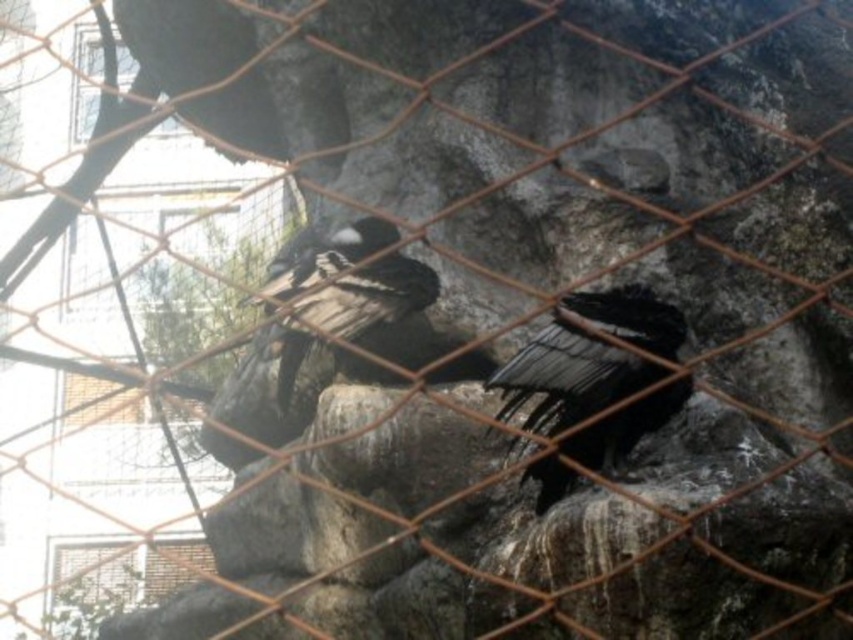
Question: Can you confirm if black feathered bird at center is positioned below shiny black feathers at center?

Choices:
 (A) no
 (B) yes

Answer: (B)

Question: Among these objects, which one is nearest to the camera?

Choices:
 (A) shiny black feathers at center
 (B) black feathered bird at center

Answer: (B)

Question: Is black feathered bird at center in front of shiny black feathers at center?

Choices:
 (A) yes
 (B) no

Answer: (A)

Question: In this image, where is black feathered bird at center located relative to shiny black feathers at center?

Choices:
 (A) left
 (B) right

Answer: (B)